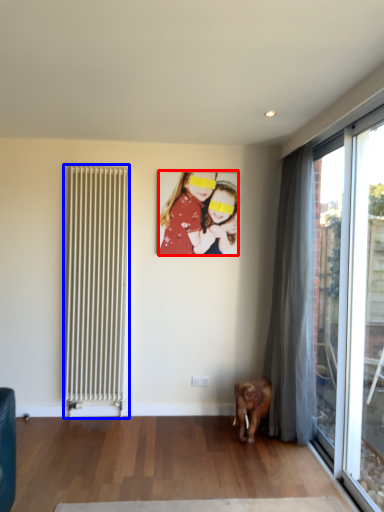
Question: Which object appears farthest to the camera in this image, person (highlighted by a red box) or radiator (highlighted by a blue box)?

Choices:
 (A) person
 (B) radiator

Answer: (A)